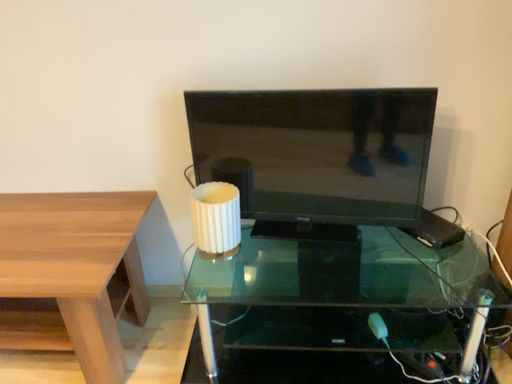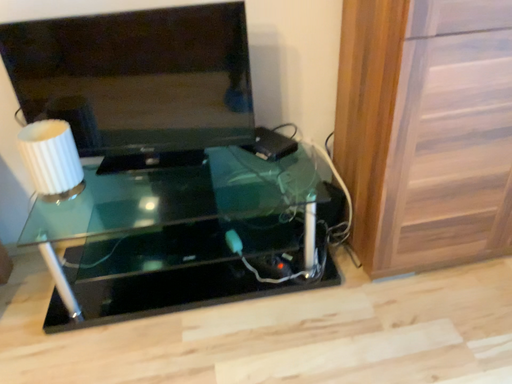
Question: How did the camera likely rotate when shooting the video?

Choices:
 (A) rotated left
 (B) rotated right

Answer: (B)